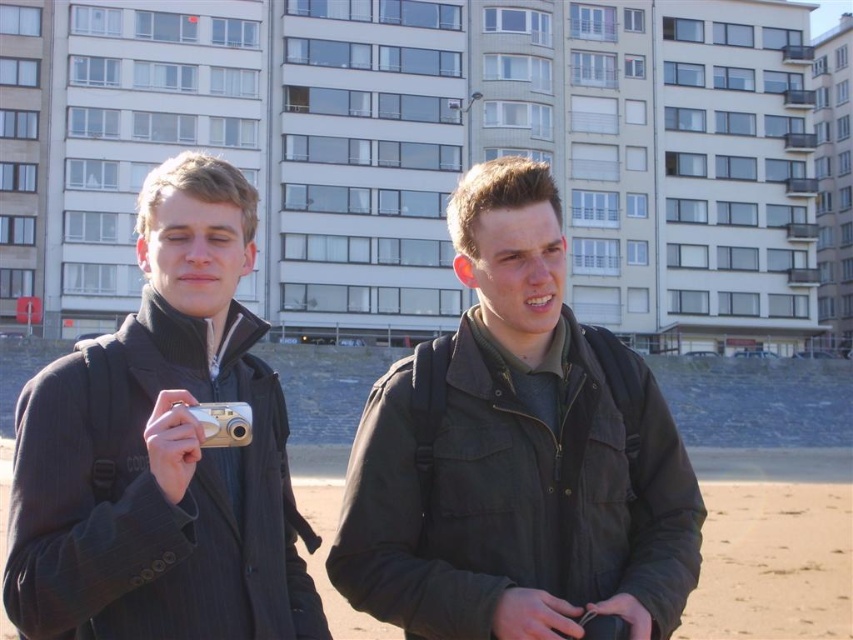
In the scene shown: You are a photographer trying to capture a photo of the silver metallic camera at center. You are standing on the sandy beach at lower center. Which object should you move closer to in order to take the photo?

The sandy beach at lower center is further to the viewer than the silver metallic camera at center, so you should move closer to the silver metallic camera at center to take the photo.

You are standing at the origin point in the image and want to walk towards the point labeled as point (227,420). Which direction should you face to ensure you are looking directly at the point labeled point (322,596) while walking towards the first point?

To face both directions simultaneously, you must first determine the relative positions. Since point (322,596) is behind point (227,420), you should walk towards point (227,420) while facing away from point (322,596). However, this creates a contradiction in directions. The question contains conflicting requirements, so it is not possible to fulfill both actions simultaneously.